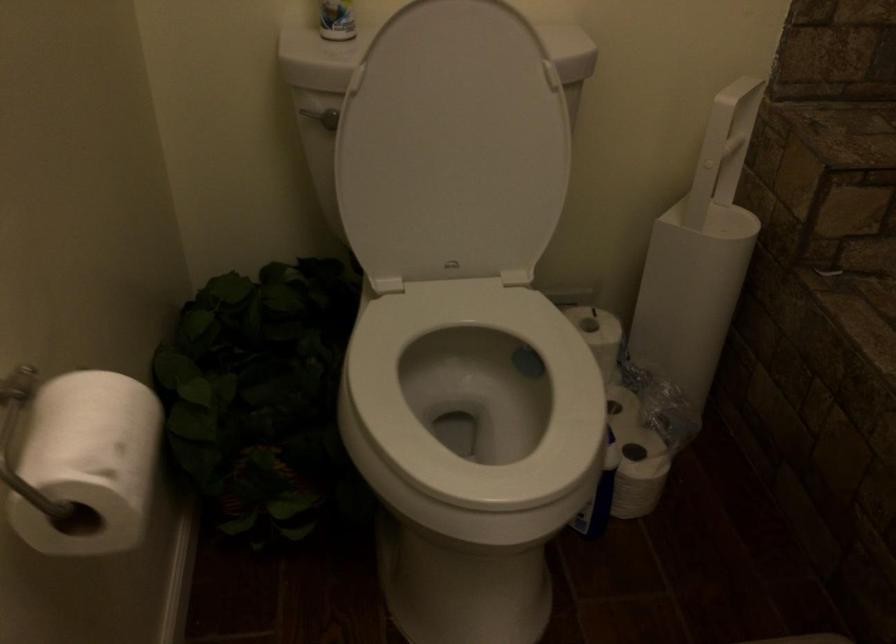
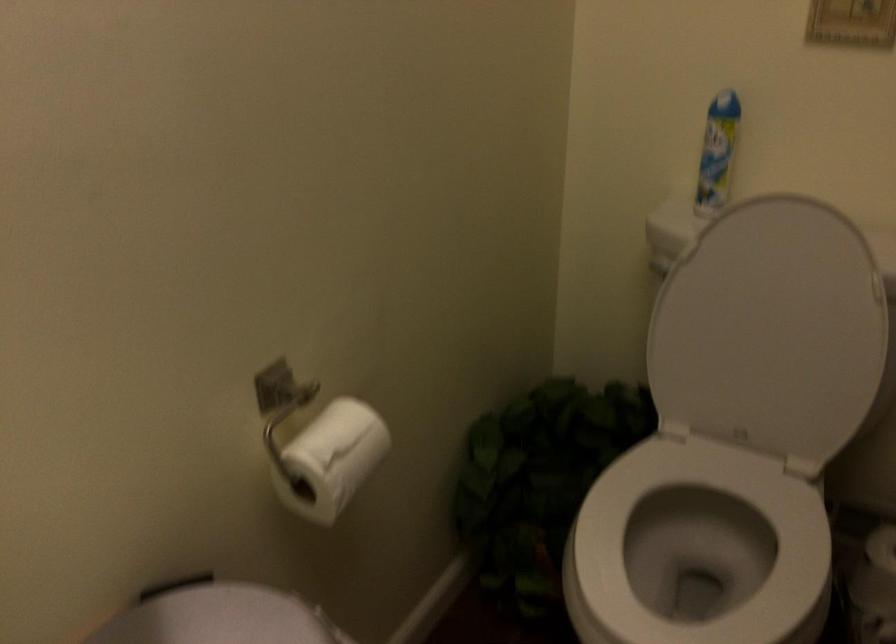
Where in the second image is the point corresponding to pixel 122 451 from the first image?

(331, 459)